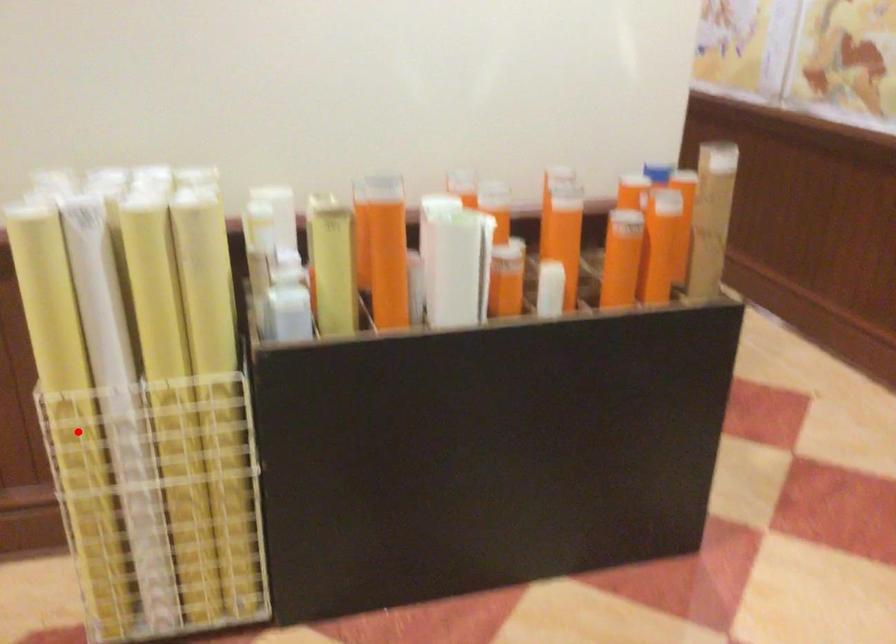
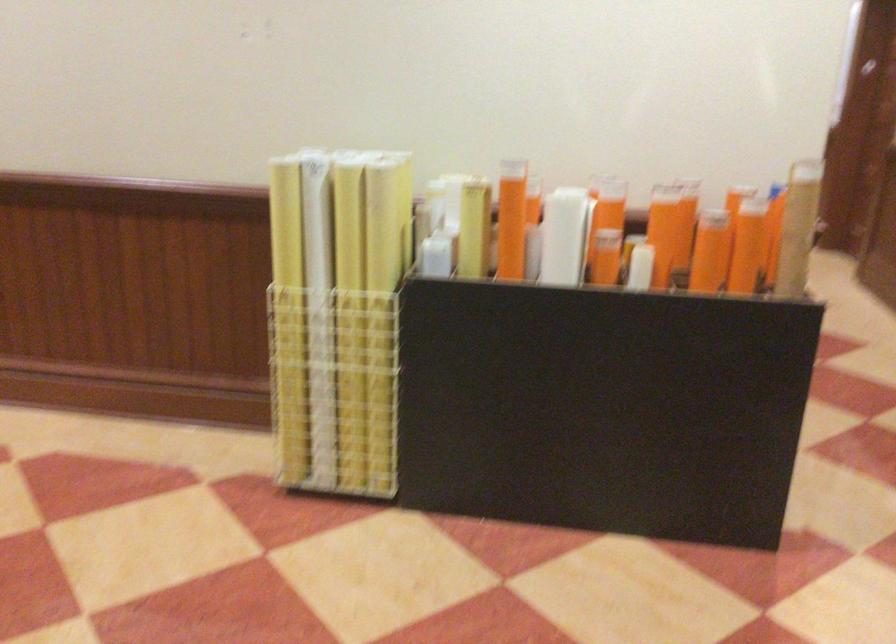
Locate, in the second image, the point that corresponds to the highlighted location in the first image.

(288, 317)